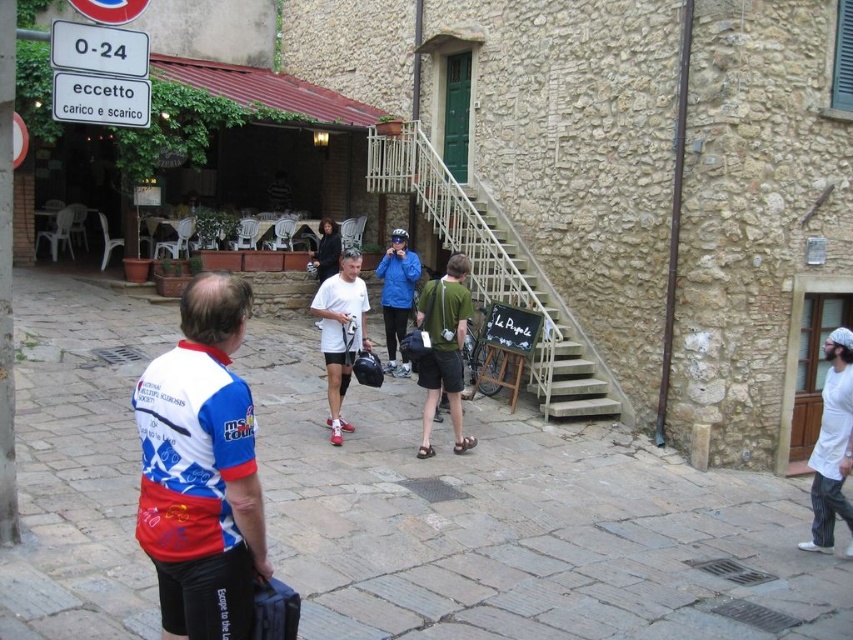
Question: From the image, what is the correct spatial relationship of brown stone pavement at center in relation to metallic staircase at center?

Choices:
 (A) right
 (B) left

Answer: (B)

Question: Which point appears closest to the camera in this image?

Choices:
 (A) (332, 248)
 (B) (141, 38)
 (C) (131, 412)

Answer: (B)

Question: Which point is farther to the camera?

Choices:
 (A) white matte t-shirt at center
 (B) white cotton chef's coat at right

Answer: (A)

Question: Can you confirm if white jersey at center is positioned below white cotton chef's coat at right?

Choices:
 (A) yes
 (B) no

Answer: (B)

Question: Which is nearer to the white jersey at center?

Choices:
 (A) green fabric shirt at center
 (B) blue matte jacket at center

Answer: (A)

Question: Can you confirm if white jersey at center is bigger than metallic staircase at center?

Choices:
 (A) yes
 (B) no

Answer: (A)